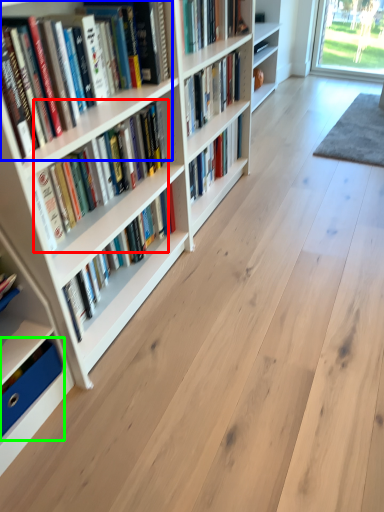
Question: Which object is positioned farthest from book (highlighted by a red box)? Select from book (highlighted by a blue box) and book (highlighted by a green box).

Choices:
 (A) book
 (B) book

Answer: (B)